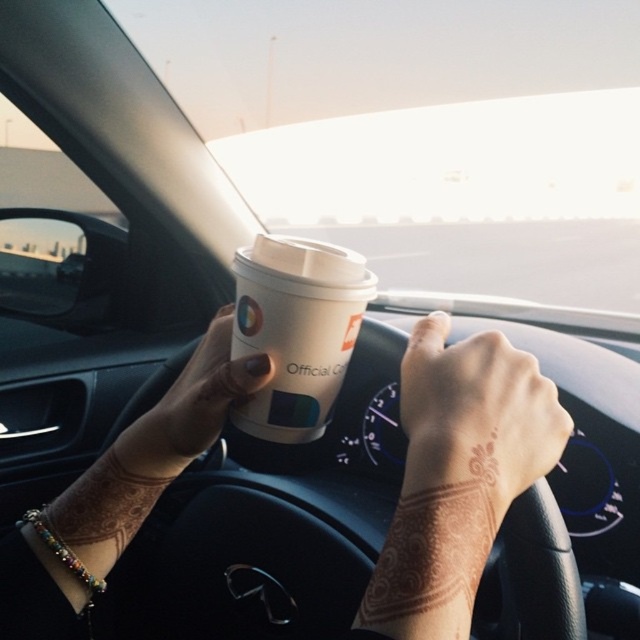
Who is positioned more to the left, white paper cup at upper center or matte white cup at center?

Positioned to the left is matte white cup at center.

Between white paper cup at upper center and matte white cup at center, which one is positioned lower?

white paper cup at upper center

Who is more distant from viewer, (x=428, y=372) or (x=216, y=326)?

The point (x=216, y=326) is behind.

You are a GUI agent. You are given a task and a screenshot of the screen. Output one action in this format:
    pyautogui.click(x=<x>, y=<y>)
    Task: Click on the white paper cup at upper center
    The image size is (640, 640).
    Given the screenshot: What is the action you would take?
    pyautogui.click(x=458, y=476)

Is the position of brown henna tattoo at center more distant than that of matte white cup at center?

No, it is in front of matte white cup at center.

This screenshot has height=640, width=640. I want to click on brown henna tattoo at center, so click(476, 412).

Does white paper cup at center have a lesser height compared to matte white cup at center?

In fact, white paper cup at center may be taller than matte white cup at center.

Between white paper cup at center and matte white cup at center, which one has less height?

With less height is matte white cup at center.

Where is `white paper cup at center`? The height and width of the screenshot is (640, 640). white paper cup at center is located at coordinates (296, 330).